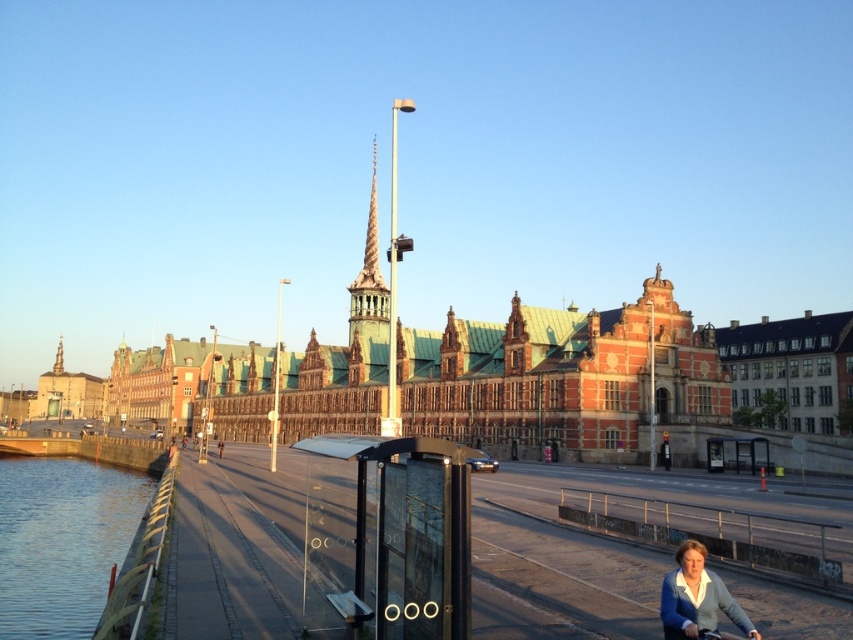
Question: From the image, what is the correct spatial relationship of clear water at lower left in relation to black matte bicycle at lower right?

Choices:
 (A) right
 (B) left

Answer: (B)

Question: Which point appears farthest from the camera in this image?

Choices:
 (A) (97, 572)
 (B) (712, 632)
 (C) (747, 627)

Answer: (A)

Question: Does light brown sweater at lower right have a smaller size compared to black matte bicycle at lower right?

Choices:
 (A) no
 (B) yes

Answer: (A)

Question: Does clear water at lower left have a smaller size compared to light brown sweater at lower right?

Choices:
 (A) no
 (B) yes

Answer: (A)

Question: Which point is closer to the camera?

Choices:
 (A) light brown sweater at lower right
 (B) clear water at lower left
 (C) black matte bicycle at lower right

Answer: (A)

Question: Which of the following is the closest to the observer?

Choices:
 (A) light brown sweater at lower right
 (B) black matte bicycle at lower right

Answer: (A)